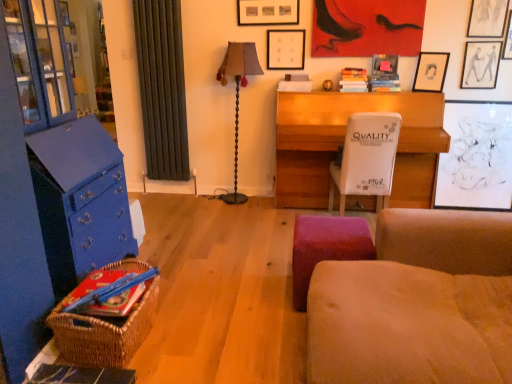
Question: Does point (225, 82) appear closer or farther from the camera than point (411, 301)?

Choices:
 (A) farther
 (B) closer

Answer: (A)

Question: From the image's perspective, is brown fabric lamp at center positioned above or below suede-like beige studio couch at lower right?

Choices:
 (A) above
 (B) below

Answer: (A)

Question: Estimate the real-world distances between objects in this image. Which object is farther from the woven brown picnic basket at lower left?

Choices:
 (A) matte black picture frame at upper right, acting as the fourth picture frame starting from the left
 (B) wooden desk at center
 (C) matte black picture frame at upper right, placed as the 5th picture frame when sorted from left to right
 (D) hardcover book at upper right, placed as the third book when sorted from bottom to top
 (E) matte black picture frame at upper right, which is the 1th picture frame from right to left

Answer: (C)

Question: Estimate the real-world distances between objects in this image. Which object is farther from the brown fabric lamp at center?

Choices:
 (A) hardcover book at upper right, positioned as the 1th book in top-to-bottom order
 (B) hardcover book at upper right, the 2th book when ordered from top to bottom
 (C) matte black picture frame at upper right, the 6th picture frame when ordered from left to right
 (D) matte black picture frame at upper right, which ranks as the 2th picture frame in right-to-left order
 (E) woven brown picnic basket at lower left

Answer: (E)